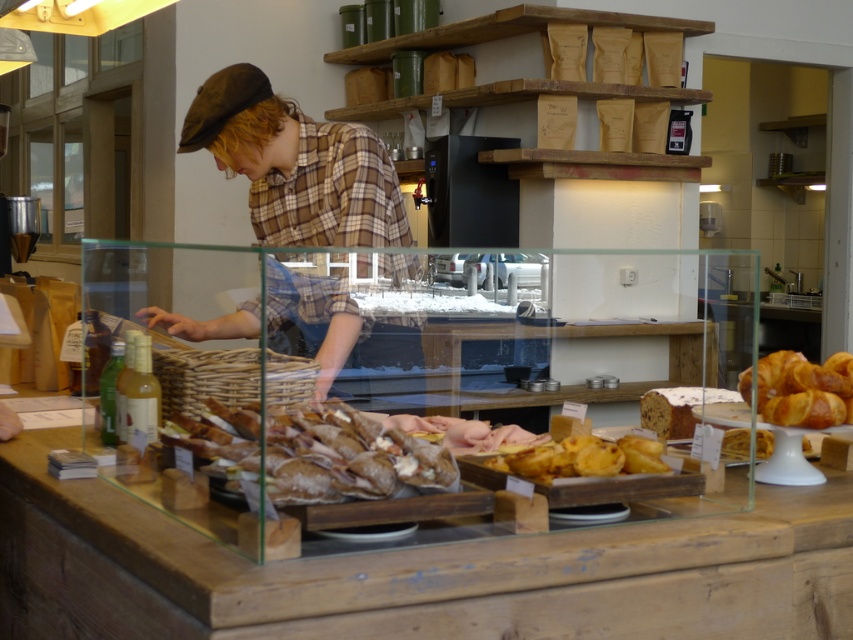
From the picture: Is brown plaid shirt at center positioned at the back of golden brown pastry at center?

No, it is not.

Which is behind, point (273, 320) or point (758, 456)?

Positioned behind is point (273, 320).

The image size is (853, 640). In order to click on brown plaid shirt at center in this screenshot , I will do `click(296, 164)`.

Can you confirm if spongy brown bread at center is smaller than golden brown pastry at center?

No, spongy brown bread at center is not smaller than golden brown pastry at center.

Locate an element on the screen. spongy brown bread at center is located at coordinates (677, 408).

Locate an element on the screen. spongy brown bread at center is located at coordinates pyautogui.click(x=677, y=408).

Locate an element on the screen. spongy brown bread at center is located at coordinates (677, 408).

Is point (341, 410) in front of point (727, 429)?

Yes.

Where is `slightly toasted bread at center`? Image resolution: width=853 pixels, height=640 pixels. slightly toasted bread at center is located at coordinates (314, 452).

Identify the location of slightly toasted bread at center. This screenshot has height=640, width=853. (314, 452).